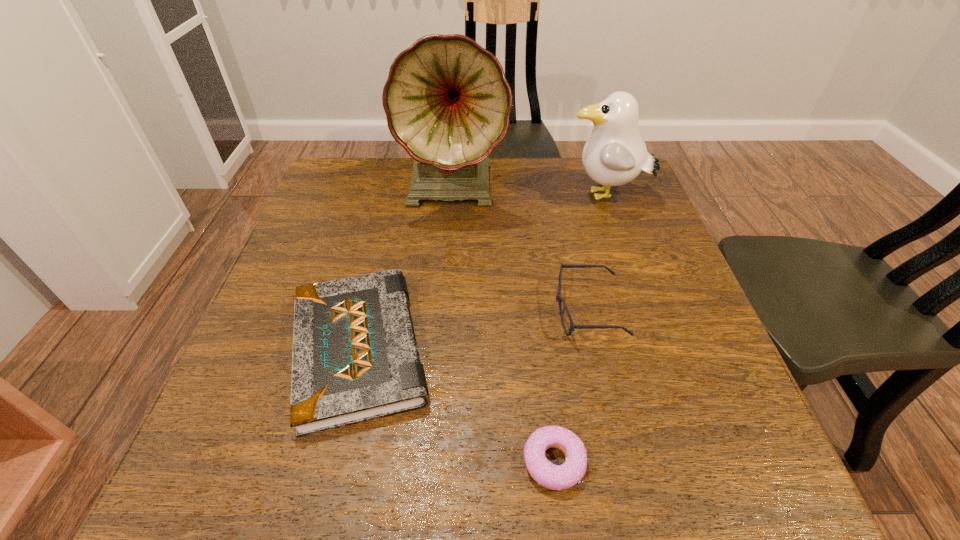
Where is `blank region between the fourth tallest object and the gull`? blank region between the fourth tallest object and the gull is located at coordinates (482, 273).

At what (x,y) coordinates should I click in order to perform the action: click on empty space between the tallest object and the notebook. Please return your answer as a coordinate pair (x, y). This screenshot has width=960, height=540. Looking at the image, I should click on (407, 268).

Where is `free space between the tallest object and the gull`? The width and height of the screenshot is (960, 540). free space between the tallest object and the gull is located at coordinates (530, 192).

Find the location of `blank region between the notebook and the fourth shortest object`. blank region between the notebook and the fourth shortest object is located at coordinates (482, 273).

This screenshot has width=960, height=540. Find the location of `vacant area that lies between the second tallest object and the notebook`. vacant area that lies between the second tallest object and the notebook is located at coordinates (482, 273).

At what (x,y) coordinates should I click in order to perform the action: click on vacant area that lies between the fourth tallest object and the tallest object. Please return your answer as a coordinate pair (x, y). Looking at the image, I should click on (407, 268).

This screenshot has width=960, height=540. I want to click on blank region between the fourth tallest object and the gull, so click(482, 273).

Where is `object that stands as the third closest to the spectacles`? object that stands as the third closest to the spectacles is located at coordinates 615,154.

At what (x,y) coordinates should I click in order to perform the action: click on object that can be found as the fourth closest to the fourth tallest object. Please return your answer as a coordinate pair (x, y). Image resolution: width=960 pixels, height=540 pixels. Looking at the image, I should click on click(615, 154).

Where is `free spot that satisfies the following two spatial constraints: 1. on the front-facing side of the third tallest object; 2. on the front side of the fourth tallest object`? The width and height of the screenshot is (960, 540). free spot that satisfies the following two spatial constraints: 1. on the front-facing side of the third tallest object; 2. on the front side of the fourth tallest object is located at coordinates (596, 349).